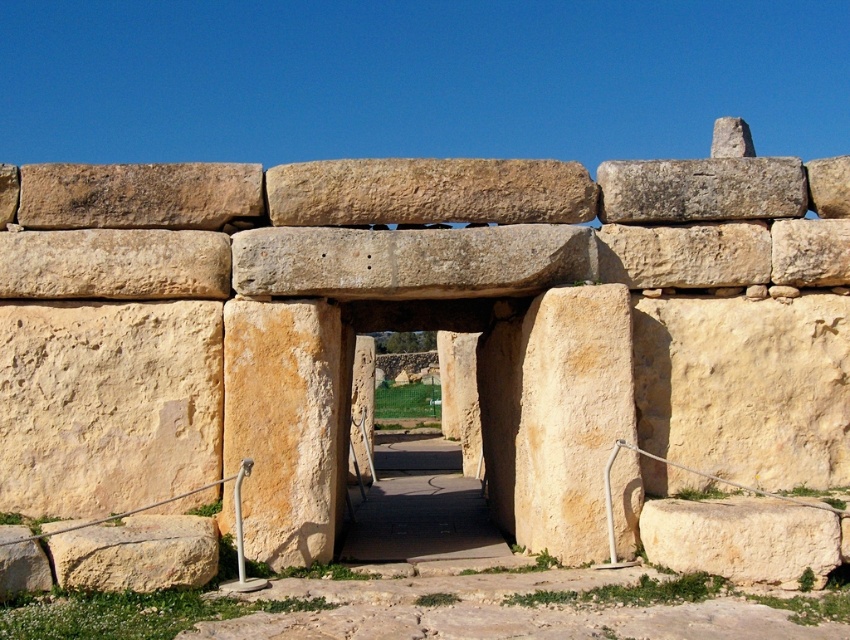
Question: Does smooth beige stone at center have a greater width compared to yellowish sandstone at lower right?

Choices:
 (A) yes
 (B) no

Answer: (A)

Question: Which point is closer to the camera taking this photo?

Choices:
 (A) (783, 244)
 (B) (142, 560)
 (C) (207, 236)
 (D) (463, 256)

Answer: (B)

Question: Is smooth beige stone at center positioned at the back of beige rough stone at lower left?

Choices:
 (A) yes
 (B) no

Answer: (A)

Question: Which point is closer to the camera?

Choices:
 (A) yellow sandstone gate at center
 (B) yellowish sandstone at lower right

Answer: (B)

Question: Is smooth stone doorway at center smaller than beige rough stone at lower left?

Choices:
 (A) no
 (B) yes

Answer: (A)

Question: Among these points, which one is nearest to the camera?

Choices:
 (A) (812, 266)
 (B) (450, 420)

Answer: (A)